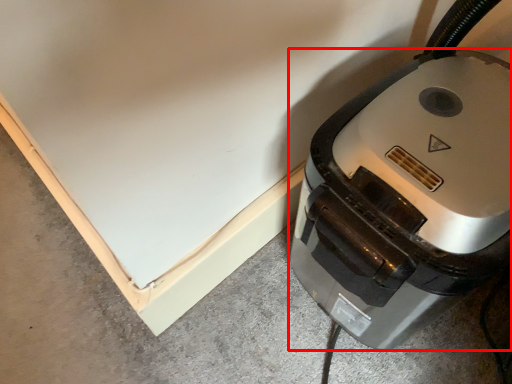
Question: From the image's perspective, where is home appliance (annotated by the red box) located relative to concrete?

Choices:
 (A) below
 (B) above

Answer: (A)